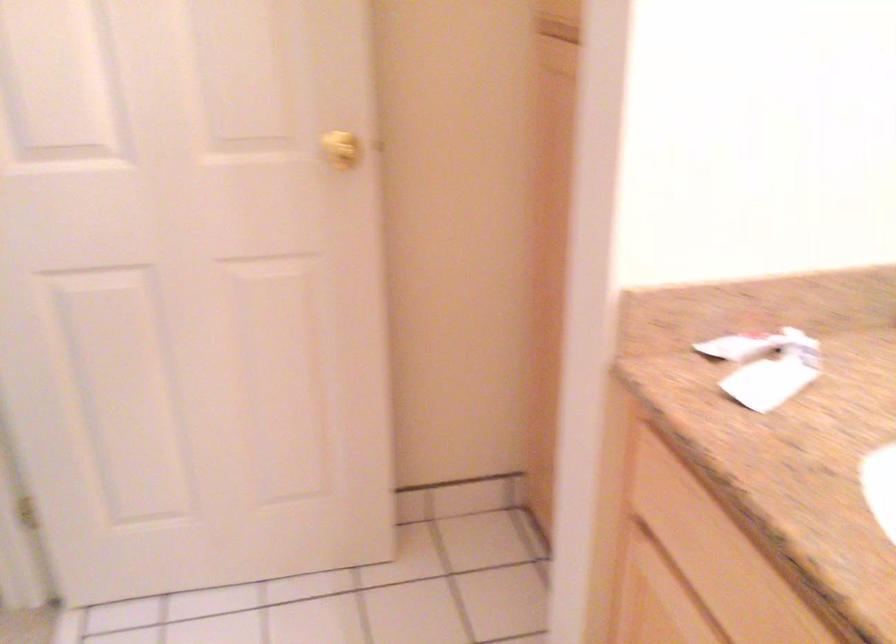
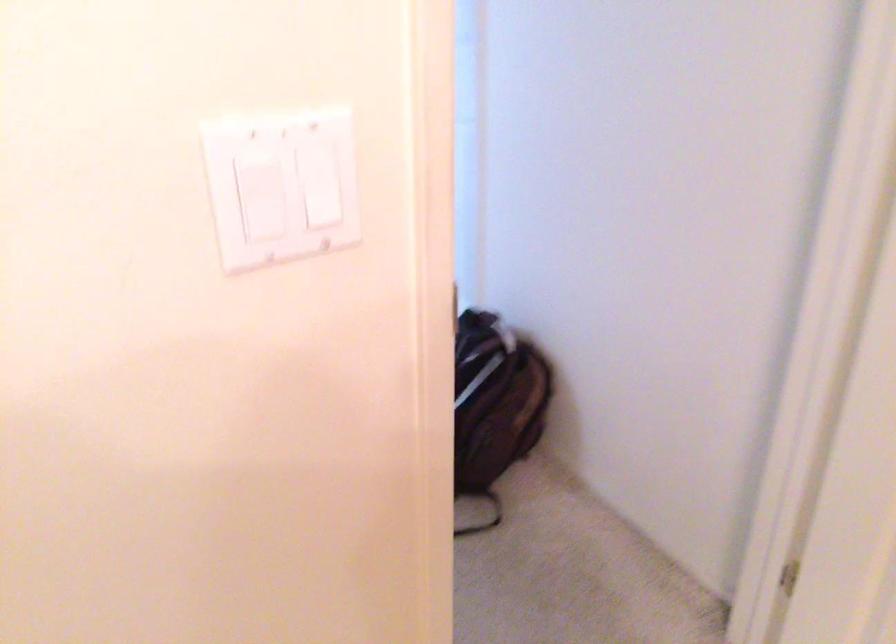
First-person continuous shooting, in which direction is the camera rotating?

The camera's rotation is toward left-down.